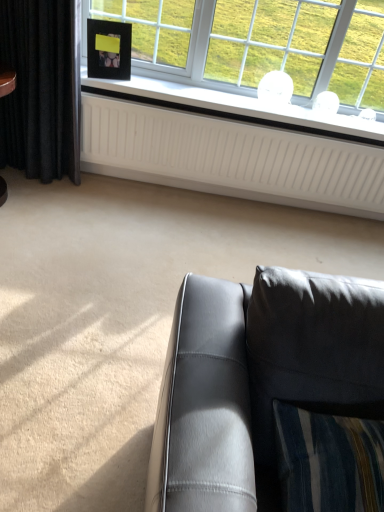
Question: From a real-world perspective, is white textured radiator at upper center positioned above or below matte gray leather couch at lower right?

Choices:
 (A) below
 (B) above

Answer: (A)

Question: Is white textured radiator at upper center in front of or behind matte gray leather couch at lower right in the image?

Choices:
 (A) behind
 (B) front

Answer: (A)

Question: Which object is the closest to the black velvet curtain at left?

Choices:
 (A) matte gray leather couch at lower right
 (B) white textured radiator at upper center
 (C) white matte window sill at upper center
 (D) black matte picture frame at upper left

Answer: (D)

Question: Based on their relative distances, which object is nearer to the matte gray leather couch at lower right?

Choices:
 (A) black matte picture frame at upper left
 (B) black velvet curtain at left
 (C) white matte window sill at upper center
 (D) white textured radiator at upper center

Answer: (D)